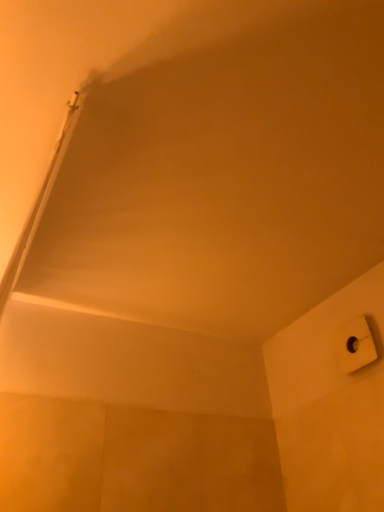
Find the location of a particular element. white matte toilet paper at lower right is located at coordinates (355, 345).

This screenshot has height=512, width=384. What do you see at coordinates (355, 345) in the screenshot?
I see `white matte toilet paper at lower right` at bounding box center [355, 345].

At what (x,y) coordinates should I click in order to perform the action: click on white matte toilet paper at lower right. Please return your answer as a coordinate pair (x, y). Looking at the image, I should click on (355, 345).